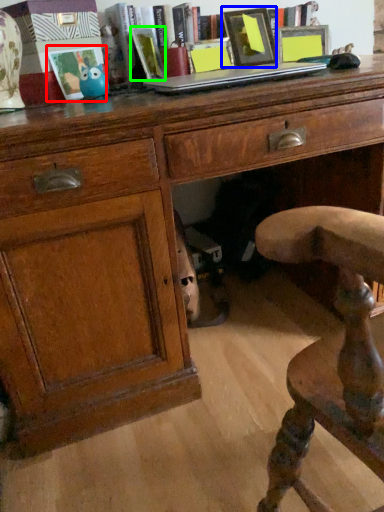
Question: Estimate the real-world distances between objects in this image. Which object is closer to picture frame (highlighted by a red box), picture frame (highlighted by a blue box) or book (highlighted by a green box)?

Choices:
 (A) picture frame
 (B) book

Answer: (B)